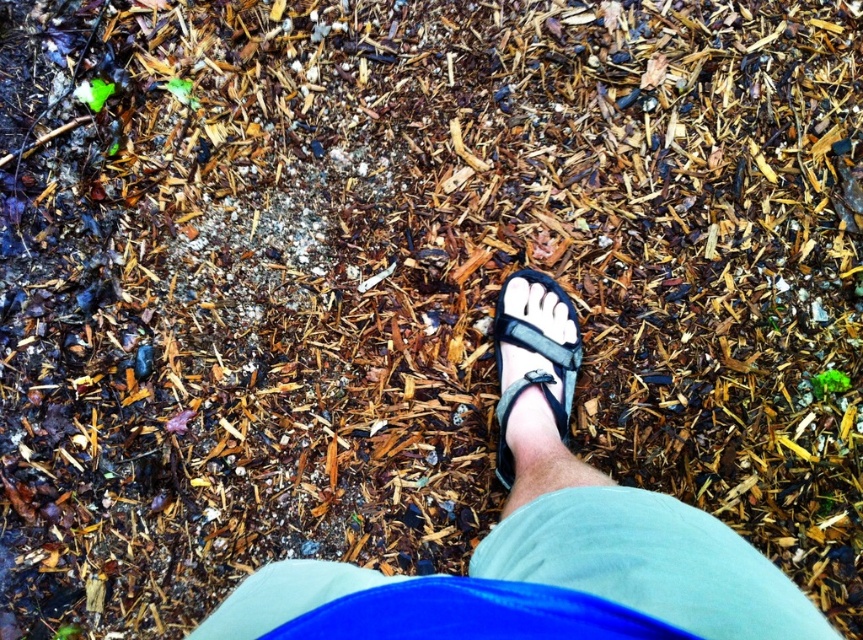
Is black fabric sandal at center smaller than black leather sandal at center?

No, black fabric sandal at center is not smaller than black leather sandal at center.

Does point (339, 592) come behind point (556, 372)?

No, it is not.

Between point (265, 596) and point (565, 304), which one is positioned behind?

Positioned behind is point (565, 304).

What are the coordinates of `black fabric sandal at center` in the screenshot? It's located at (542, 538).